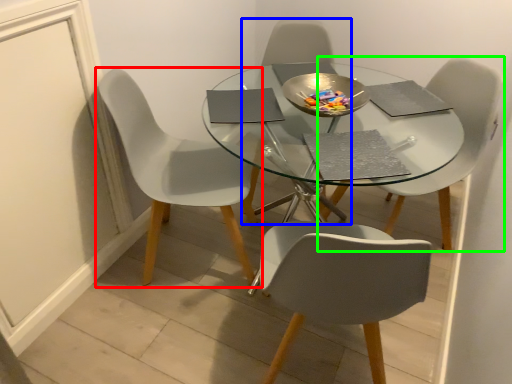
Question: Estimate the real-world distances between objects in this image. Which object is farther from chair (highlighted by a red box), chair (highlighted by a blue box) or chair (highlighted by a green box)?

Choices:
 (A) chair
 (B) chair

Answer: (B)